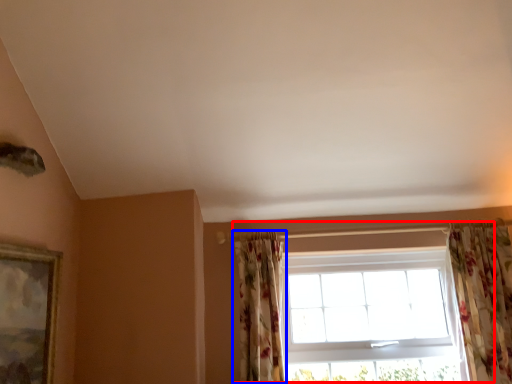
Question: Which object appears farthest to the camera in this image, window (highlighted by a red box) or curtain (highlighted by a blue box)?

Choices:
 (A) window
 (B) curtain

Answer: (A)